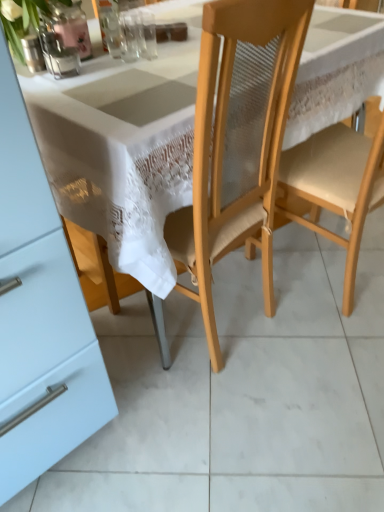
Identify the location of vacant area that is situated to the right of wooden chair at center, which ranks as the 2th chair in right-to-left order. The width and height of the screenshot is (384, 512). (311, 338).